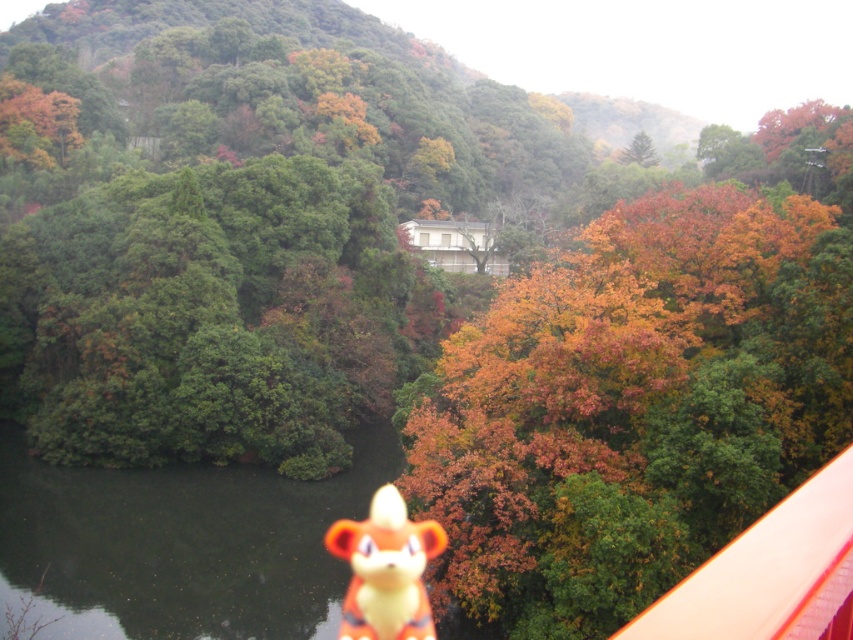
Does autumn leaves at center lie behind orange plush toy at center?

No, autumn leaves at center is in front of orange plush toy at center.

Which is more to the left, autumn leaves at center or orange plush toy at center?

From the viewer's perspective, orange plush toy at center appears more on the left side.

You are a GUI agent. You are given a task and a screenshot of the screen. Output one action in this format:
    pyautogui.click(x=<x>, y=<y>)
    Task: Click on the autumn leaves at center
    This screenshot has width=853, height=640.
    Given the screenshot: What is the action you would take?
    pyautogui.click(x=631, y=404)

What are the coordinates of `autumn leaves at center` in the screenshot? It's located at (631, 404).